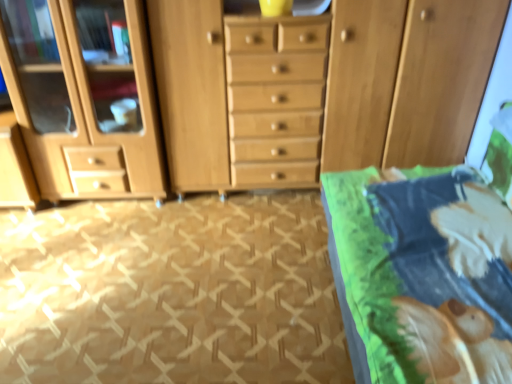
Question: From the image's perspective, is green fabric bed at right over wooden dresser at center?

Choices:
 (A) no
 (B) yes

Answer: (A)

Question: Is green fabric bed at right facing towards wooden dresser at center?

Choices:
 (A) yes
 (B) no

Answer: (B)

Question: From a real-world perspective, is green fabric bed at right located beneath wooden dresser at center?

Choices:
 (A) yes
 (B) no

Answer: (A)

Question: Is green fabric bed at right far from wooden dresser at center?

Choices:
 (A) yes
 (B) no

Answer: (B)

Question: Is green fabric bed at right positioned in front of wooden dresser at center?

Choices:
 (A) no
 (B) yes

Answer: (B)

Question: From the image's perspective, relative to wooden dresser at center, is beige carpet at lower left above or below?

Choices:
 (A) above
 (B) below

Answer: (B)

Question: Is beige carpet at lower left inside or outside of wooden dresser at center?

Choices:
 (A) outside
 (B) inside

Answer: (A)

Question: Considering the positions of beige carpet at lower left and wooden dresser at center in the image, is beige carpet at lower left taller or shorter than wooden dresser at center?

Choices:
 (A) tall
 (B) short

Answer: (B)

Question: Considering the relative positions of beige carpet at lower left and wooden dresser at center in the image provided, is beige carpet at lower left to the left or to the right of wooden dresser at center?

Choices:
 (A) left
 (B) right

Answer: (A)

Question: In the image, is beige carpet at lower left on the left side or the right side of green fabric bed at right?

Choices:
 (A) right
 (B) left

Answer: (B)

Question: From the image's perspective, is beige carpet at lower left positioned above or below green fabric bed at right?

Choices:
 (A) above
 (B) below

Answer: (B)

Question: Does point (160, 382) appear closer or farther from the camera than point (509, 311)?

Choices:
 (A) farther
 (B) closer

Answer: (A)

Question: Is beige carpet at lower left wider or thinner than green fabric bed at right?

Choices:
 (A) wide
 (B) thin

Answer: (A)

Question: Visually, is wooden dresser at center positioned to the left or to the right of green fabric bed at right?

Choices:
 (A) right
 (B) left

Answer: (B)

Question: From a real-world perspective, is wooden dresser at center positioned above or below green fabric bed at right?

Choices:
 (A) below
 (B) above

Answer: (B)